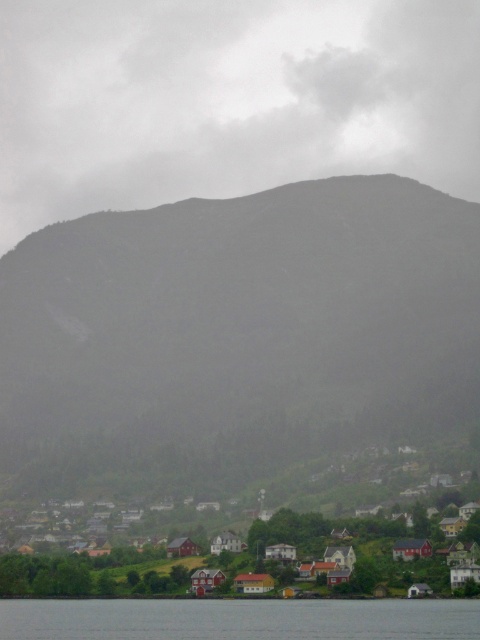
Who is positioned more to the right, green textured mountain at center or transparent water at lower center?

green textured mountain at center

Which is above, green textured mountain at center or transparent water at lower center?

Positioned higher is green textured mountain at center.

Is point (467, 228) farther from camera compared to point (24, 630)?

Yes, it is behind point (24, 630).

Locate an element on the screen. This screenshot has height=640, width=480. green textured mountain at center is located at coordinates [x=240, y=328].

Who is more distant from viewer, (112, 556) or (420, 614)?

Positioned behind is point (112, 556).

Locate an element on the screen. This screenshot has width=480, height=640. red wooden houses at lower center is located at coordinates (241, 520).

Locate an element on the screen. This screenshot has height=640, width=480. red wooden houses at lower center is located at coordinates (241, 520).

Does point (0, 308) come behind point (307, 520)?

Yes, it is behind point (307, 520).

Between green textured mountain at center and red wooden houses at lower center, which one appears on the right side from the viewer's perspective?

red wooden houses at lower center is more to the right.

Who is more distant from viewer, (x=290, y=269) or (x=340, y=483)?

Point (x=290, y=269)

The width and height of the screenshot is (480, 640). Find the location of `green textured mountain at center`. green textured mountain at center is located at coordinates (240, 328).